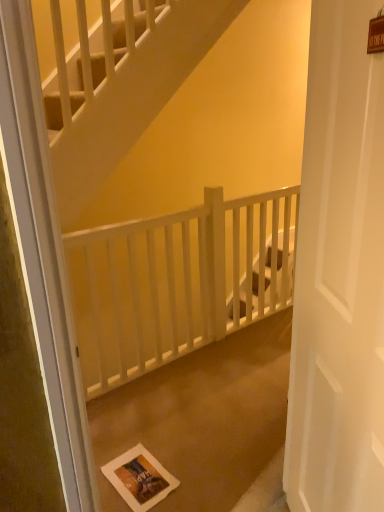
Identify the location of free space in front of white wooden balustrade at center. This screenshot has width=384, height=512. (196, 404).